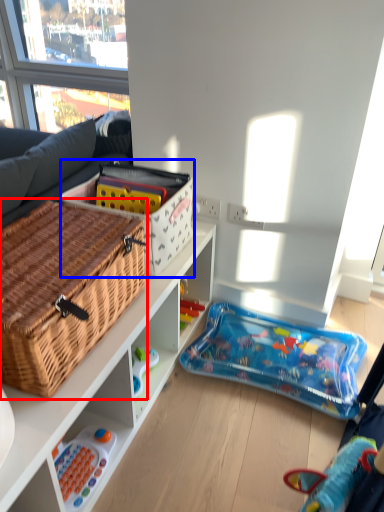
Question: Among these objects, which one is farthest to the camera, picnic basket (highlighted by a red box) or cardboard box (highlighted by a blue box)?

Choices:
 (A) picnic basket
 (B) cardboard box

Answer: (B)